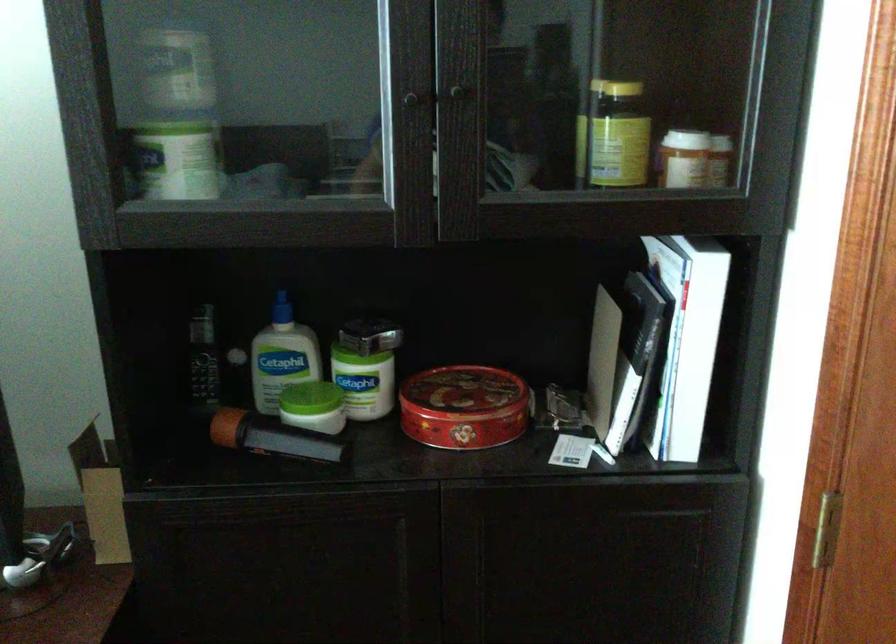
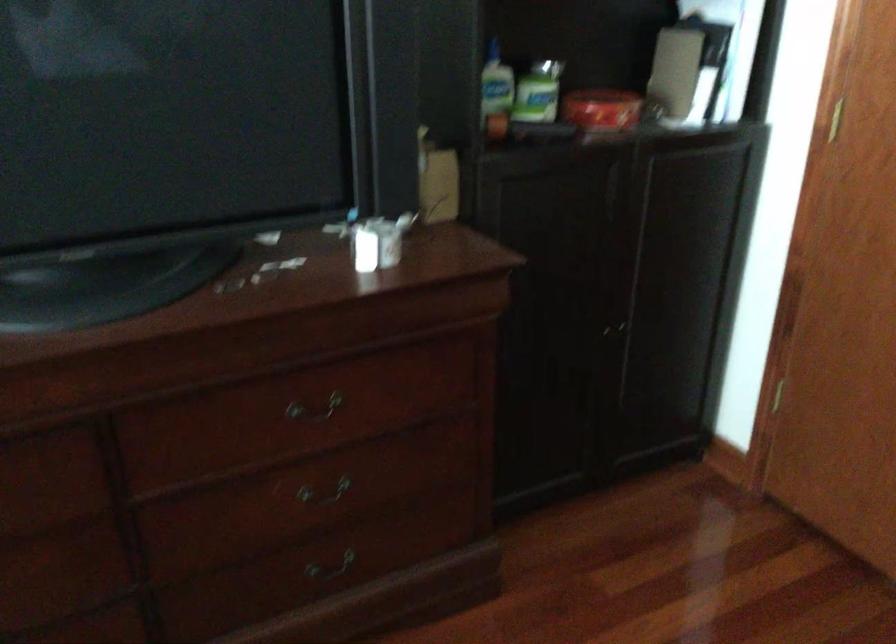
Find the pixel in the second image that matches point (356, 377) in the first image.

(538, 91)